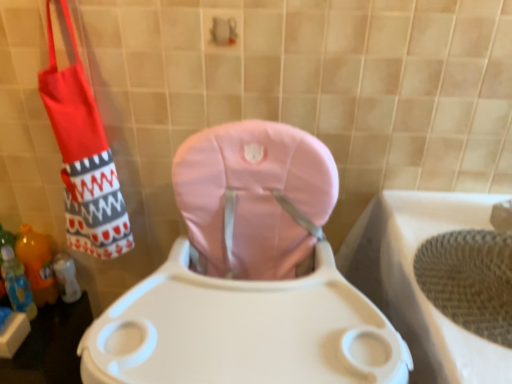
Image resolution: width=512 pixels, height=384 pixels. I want to click on free point above woven beige bath at lower right (from a real-world perspective), so click(455, 254).